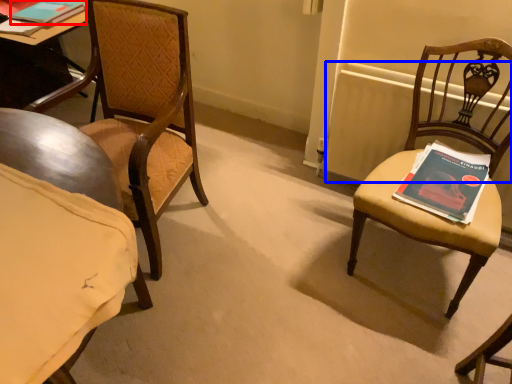
Question: Which of the following is the closest to the observer, book (highlighted by a red box) or radiator (highlighted by a blue box)?

Choices:
 (A) book
 (B) radiator

Answer: (B)